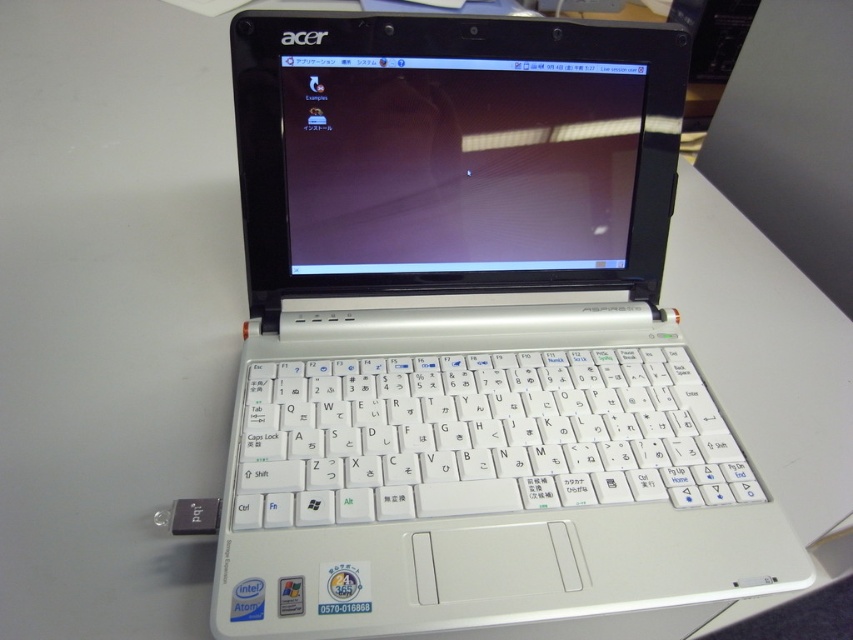
Which is in front, point (270, 404) or point (331, 236)?

Point (270, 404)

Looking at this image, who is positioned more to the left, white plastic keyboard at center or matte plastic screen at center?

From the viewer's perspective, matte plastic screen at center appears more on the left side.

Image resolution: width=853 pixels, height=640 pixels. In order to click on white plastic keyboard at center in this screenshot , I will do `click(479, 436)`.

Where is `white plastic keyboard at center`? This screenshot has height=640, width=853. white plastic keyboard at center is located at coordinates (479, 436).

Who is shorter, white plastic laptop at center or white plastic keyboard at center?

white plastic keyboard at center

Is the position of white plastic laptop at center more distant than that of white plastic keyboard at center?

That is False.

Is point (392, 355) positioned behind point (639, 372)?

No, it is not.

At what (x,y) coordinates should I click in order to perform the action: click on white plastic laptop at center. Please return your answer as a coordinate pair (x, y). The width and height of the screenshot is (853, 640). Looking at the image, I should click on (471, 340).

Does white plastic laptop at center have a lesser width compared to matte plastic screen at center?

In fact, white plastic laptop at center might be wider than matte plastic screen at center.

Which is above, white plastic laptop at center or matte plastic screen at center?

matte plastic screen at center

Locate an element on the screen. The image size is (853, 640). white plastic laptop at center is located at coordinates (471, 340).